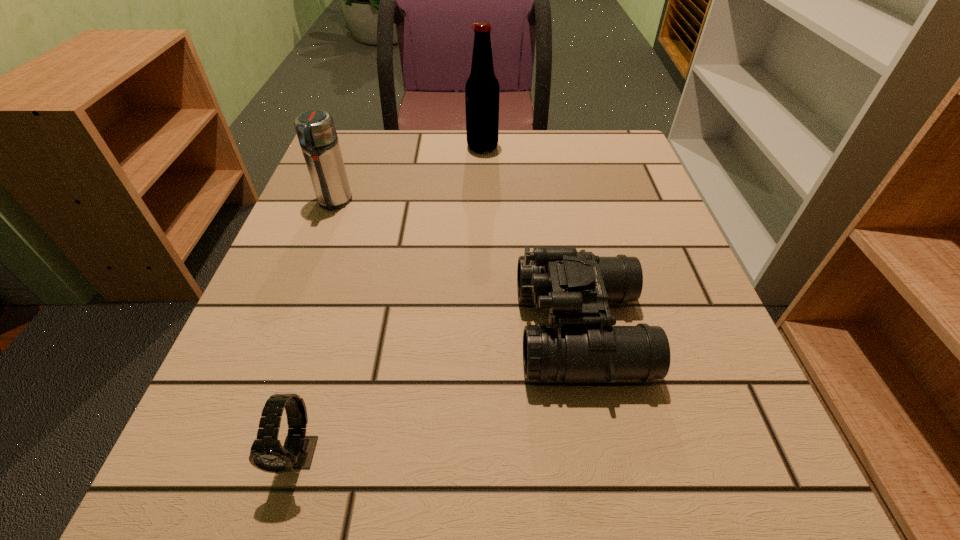
At what (x,y) coordinates should I click in order to perform the action: click on free space located 0.190m through the lenses of the third farthest object. Please return your answer as a coordinate pair (x, y). The image size is (960, 540). Looking at the image, I should click on (399, 329).

Find the location of `free space located through the lenses of the third farthest object`. free space located through the lenses of the third farthest object is located at coordinates (324, 329).

In order to click on vacant space located 0.080m through the lenses of the third farthest object in this screenshot , I will do `click(469, 329)`.

The height and width of the screenshot is (540, 960). I want to click on object present at the far edge, so click(482, 88).

Where is `object present at the near edge`? The width and height of the screenshot is (960, 540). object present at the near edge is located at coordinates (267, 454).

Image resolution: width=960 pixels, height=540 pixels. Identify the location of thermos bottle at the left edge. pyautogui.click(x=315, y=129).

Find the location of a particular element. watch present at the left edge is located at coordinates (267, 454).

Where is `object positioned at the right edge`? The height and width of the screenshot is (540, 960). object positioned at the right edge is located at coordinates [x=580, y=344].

Find the location of a particular element. Image resolution: width=960 pixels, height=540 pixels. object located at the near left corner is located at coordinates pos(267,454).

Image resolution: width=960 pixels, height=540 pixels. I want to click on free space at the far edge of the desktop, so click(x=396, y=168).